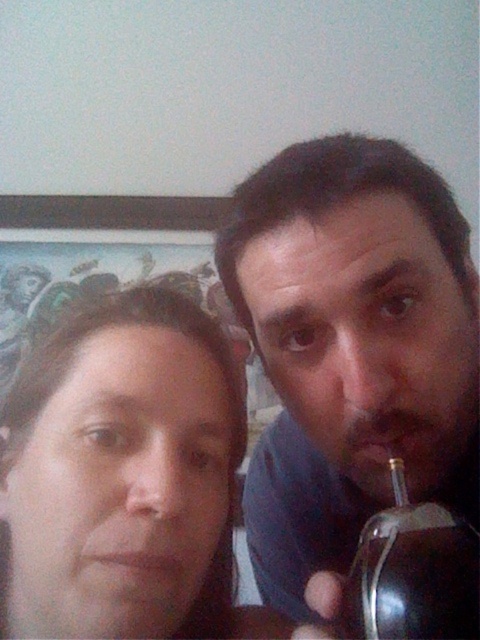
You are a barista who needs to prepare a drink for a customer. You see the matte black cup at right and the matte black hair at center in the scene. Which object is taller?

The matte black cup at right is taller than the matte black hair at center according to the description.

You are a barista preparing drinks for customers. You have a matte black cup at right and a transparent glass bottle at right. Which container should you choose if you need to serve a hot beverage that requires insulation?

The matte black cup at right is more suitable for serving hot beverages that require insulation because it is wider than the transparent glass bottle at right, which may not provide the same level of insulation.

You are a photographer setting up a shot for a magazine. You need to ensure that both the matte black cup at right and the matte black hair at center are in focus. Given their positions, which object should you adjust your camera focus on first to ensure both are sharp?

The matte black cup at right is closer to the viewer than the matte black hair at center. To ensure both are in focus, you should focus on the matte black cup at right first, as it is the closer object, and then adjust the focus to include the matte black hair at center within the depth of field.